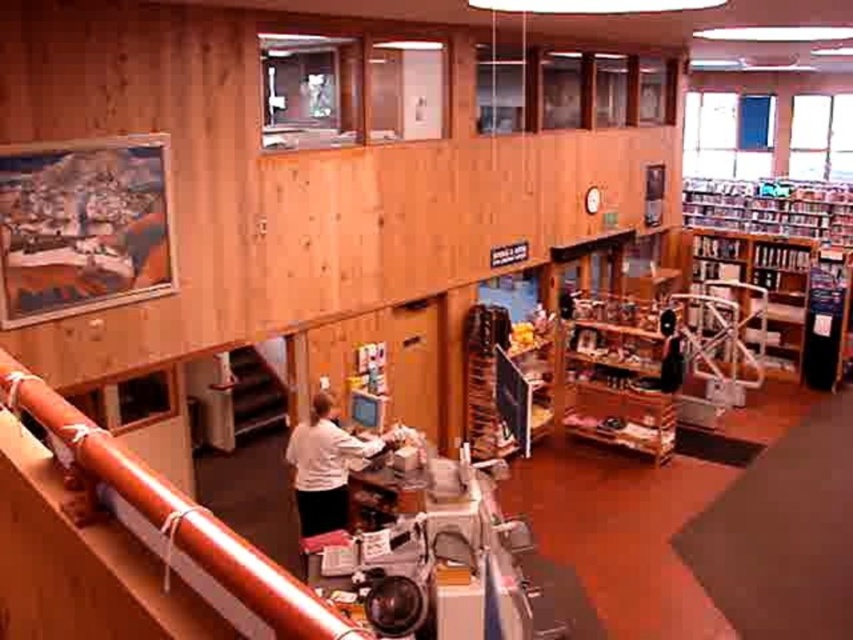
You are standing at the railing in the bookstore and want to know how far you are from the point marked as point (x=28, y=401). Can you determine the distance?

The distance between the viewer and point (x=28, y=401) is 1.64 meters.